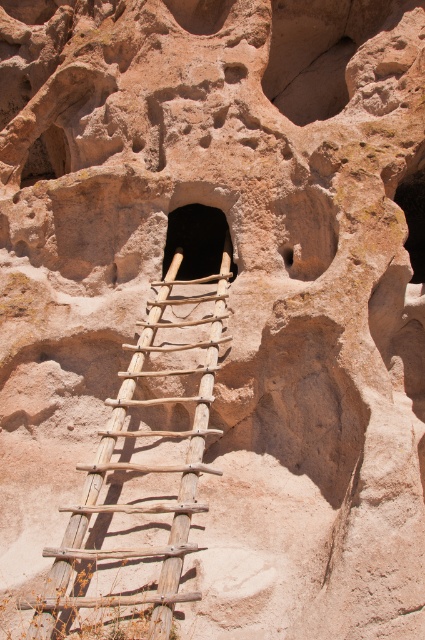
Question: Which object is positioned closest to the smooth sandstone hole at center?

Choices:
 (A) wooden ladder at center
 (B) brown wooden hole at center
 (C) smooth rock cave at upper left

Answer: (B)

Question: Can you confirm if smooth sandstone hole at upper center is thinner than smooth rock cave at upper left?

Choices:
 (A) yes
 (B) no

Answer: (A)

Question: Based on their relative distances, which object is farther from the smooth sandstone hole at center?

Choices:
 (A) wooden ladder at center
 (B) smooth sandstone hole at upper center
 (C) smooth rock cave at upper left
 (D) smooth rock hole at right

Answer: (C)

Question: Is the position of smooth sandstone hole at center less distant than that of brown wooden hole at center?

Choices:
 (A) yes
 (B) no

Answer: (A)

Question: Which point is closer to the camera?

Choices:
 (A) (147, 330)
 (B) (280, 106)
 (C) (277, 212)
 (D) (405, 246)

Answer: (D)

Question: Is smooth sandstone hole at center wider than smooth rock cave at upper left?

Choices:
 (A) yes
 (B) no

Answer: (B)